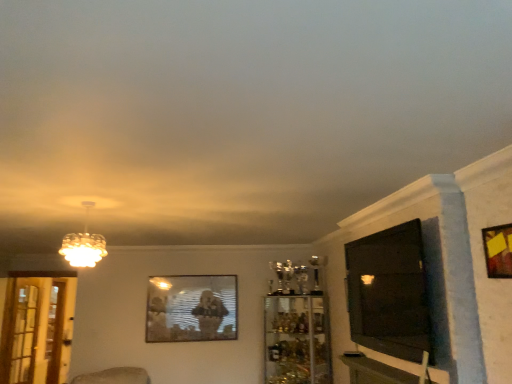
This screenshot has width=512, height=384. I want to click on wooden frame at upper right, the first picture frame from the top, so click(x=498, y=250).

This screenshot has height=384, width=512. What are the coordinates of `clear glass screen door at left, which appears as the second screen door when viewed from the left` in the screenshot? It's located at (37, 330).

The width and height of the screenshot is (512, 384). Describe the element at coordinates (84, 244) in the screenshot. I see `matte glass chandelier at upper left` at that location.

The image size is (512, 384). In order to click on wooden table at lower right in this screenshot , I will do `click(382, 371)`.

The image size is (512, 384). Identify the location of wooden screen door at left, which is the second screen door from front to back. (55, 331).

I want to click on open below the wooden frame at upper right, which is counted as the second picture frame, starting from the left (from the image's perspective), so click(389, 293).

Is black glossy tv at right oriented away from wooden frame at upper right, arranged as the second picture frame when viewed from the back?

black glossy tv at right does not have its back to wooden frame at upper right, arranged as the second picture frame when viewed from the back.

Is black glossy tv at right far away from wooden frame at upper right, the first picture frame from the top?

black glossy tv at right is actually quite close to wooden frame at upper right, the first picture frame from the top.

Considering their positions, is black glossy tv at right located in front of or behind wooden frame at upper right, which is counted as the second picture frame, starting from the left?

Clearly, black glossy tv at right is behind wooden frame at upper right, which is counted as the second picture frame, starting from the left.

You are a GUI agent. You are given a task and a screenshot of the screen. Output one action in this format:
    pyautogui.click(x=<x>, y=<y>)
    Task: Click on the furniture directly beneath the wooden frame at upper right, the first picture frame when ordered from front to back (from a real-world perspective)
    
    Given the screenshot: What is the action you would take?
    pyautogui.click(x=297, y=340)

Consider the image. From a real-world perspective, is wooden frame at upper right, arranged as the second picture frame when viewed from the back, physically located above or below clear glass cabinet at center?

In terms of real-world spatial position, wooden frame at upper right, arranged as the second picture frame when viewed from the back, is above clear glass cabinet at center.

Consider the image. Is wooden frame at upper right, the second picture frame in the bottom-to-top sequence, oriented away from clear glass cabinet at center?

No, wooden frame at upper right, the second picture frame in the bottom-to-top sequence, is not facing away from clear glass cabinet at center.

From the image's perspective, is wooden frame at upper right, the first picture frame when ordered from front to back, on clear glass cabinet at center?

Yes, from the image's perspective, wooden frame at upper right, the first picture frame when ordered from front to back, is over clear glass cabinet at center.

Does wooden table at lower right have a greater height compared to clear glass screen door at left, which is counted as the 1th screen door, starting from the front?

In fact, wooden table at lower right may be shorter than clear glass screen door at left, which is counted as the 1th screen door, starting from the front.

From a real-world perspective, relative to clear glass screen door at left, which appears as the second screen door when viewed from the left, is wooden table at lower right vertically above or below?

In terms of real-world spatial position, wooden table at lower right is above clear glass screen door at left, which appears as the second screen door when viewed from the left.

Is wooden table at lower right oriented away from clear glass screen door at left, which appears as the second screen door when viewed from the left?

No, wooden table at lower right's orientation is not away from clear glass screen door at left, which appears as the second screen door when viewed from the left.

I want to click on table in front of the clear glass screen door at left, positioned as the 1th screen door in right-to-left order, so click(x=382, y=371).

From the image's perspective, which is above, clear glass cabinet at center or wooden table at lower right?

wooden table at lower right, from the image's perspective.

From a real-world perspective, between clear glass cabinet at center and wooden table at lower right, who is vertically lower?

clear glass cabinet at center.

Which object is positioned more to the left, clear glass cabinet at center or wooden table at lower right?

Positioned to the left is clear glass cabinet at center.

Is clear glass cabinet at center completely or partially outside of wooden table at lower right?

Yes, clear glass cabinet at center is located beyond the bounds of wooden table at lower right.

Is clear glass screen door at left, which is counted as the 1th screen door, starting from the front, not near wooden screen door at left, which is the 2th screen door from right to left?

No, clear glass screen door at left, which is counted as the 1th screen door, starting from the front, is not far from wooden screen door at left, which is the 2th screen door from right to left.

Who is taller, clear glass screen door at left, which is counted as the 1th screen door, starting from the front, or wooden screen door at left, marked as the 1th screen door in a left-to-right arrangement?

wooden screen door at left, marked as the 1th screen door in a left-to-right arrangement, is taller.

Is the position of clear glass screen door at left, positioned as the 1th screen door in right-to-left order, more distant than that of wooden screen door at left, the first screen door viewed from the back?

No, the depth of clear glass screen door at left, positioned as the 1th screen door in right-to-left order, is less than that of wooden screen door at left, the first screen door viewed from the back.

Does point (10, 379) appear closer or farther from the camera than point (56, 371)?

Point (10, 379).

Between wooden table at lower right and clear glass cabinet at center, which one has larger size?

Bigger between the two is clear glass cabinet at center.

Which point is more forward, (x=352, y=383) or (x=278, y=364)?

Point (x=352, y=383)

Choose the correct answer: Is wooden table at lower right inside clear glass cabinet at center or outside it?

wooden table at lower right is located beyond the bounds of clear glass cabinet at center.

Could you tell me if wooden table at lower right is turned towards clear glass cabinet at center?

No, wooden table at lower right is not facing towards clear glass cabinet at center.

Find the location of a particular element. picture frame below the black glossy tv at right (from the image's perspective) is located at coordinates (192, 308).

Is black glossy tv at right oriented towards metallic reflective frame at center, placed as the 2th picture frame when sorted from front to back?

No, black glossy tv at right is not facing towards metallic reflective frame at center, placed as the 2th picture frame when sorted from front to back.

Would you say black glossy tv at right is to the left or to the right of metallic reflective frame at center, the 1th picture frame viewed from the back, in the picture?

black glossy tv at right is positioned on metallic reflective frame at center, the 1th picture frame viewed from the back,'s right side.

Which is in front, point (386, 269) or point (219, 308)?

Point (386, 269)

You are a GUI agent. You are given a task and a screenshot of the screen. Output one action in this format:
    pyautogui.click(x=<x>, y=<y>)
    Task: Click on the open behind the wooden frame at upper right, the first picture frame when ordered from front to back
    
    Given the screenshot: What is the action you would take?
    pyautogui.click(x=389, y=293)

Where is `furniture lying below the wooden frame at upper right, the second picture frame in the bottom-to-top sequence (from the image's perspective)`? This screenshot has width=512, height=384. furniture lying below the wooden frame at upper right, the second picture frame in the bottom-to-top sequence (from the image's perspective) is located at coordinates (297, 340).

Based on their spatial positions, is wooden table at lower right or matte glass chandelier at upper left closer to wooden frame at upper right, the first picture frame when ordered from front to back?

wooden table at lower right is positioned closer to the anchor wooden frame at upper right, the first picture frame when ordered from front to back.

Looking at the image, which one is located closer to wooden screen door at left, which is the second screen door from front to back, black glossy tv at right or clear glass screen door at left, which is counted as the 1th screen door, starting from the front?

clear glass screen door at left, which is counted as the 1th screen door, starting from the front.

Looking at the image, which one is located further to wooden frame at upper right, the second picture frame in the bottom-to-top sequence, clear glass screen door at left, which is counted as the 1th screen door, starting from the front, or black glossy tv at right?

clear glass screen door at left, which is counted as the 1th screen door, starting from the front, lies further to wooden frame at upper right, the second picture frame in the bottom-to-top sequence, than the other object.

Based on their spatial positions, is metallic reflective frame at center, placed as the 2th picture frame when sorted from front to back, or wooden frame at upper right, the second picture frame in the bottom-to-top sequence, further from wooden screen door at left, marked as the 1th screen door in a left-to-right arrangement?

wooden frame at upper right, the second picture frame in the bottom-to-top sequence, is further to wooden screen door at left, marked as the 1th screen door in a left-to-right arrangement.

Which object lies further to the anchor point wooden screen door at left, marked as the 1th screen door in a left-to-right arrangement, black glossy tv at right or matte glass chandelier at upper left?

The object further to wooden screen door at left, marked as the 1th screen door in a left-to-right arrangement, is black glossy tv at right.

Looking at the image, which one is located closer to clear glass screen door at left, which appears as the second screen door when viewed from the left, clear glass cabinet at center or wooden screen door at left, which is the 2th screen door from right to left?

wooden screen door at left, which is the 2th screen door from right to left, lies closer to clear glass screen door at left, which appears as the second screen door when viewed from the left, than the other object.

Estimate the real-world distances between objects in this image. Which object is further from clear glass screen door at left, which is counted as the 1th screen door, starting from the front, black glossy tv at right or wooden table at lower right?

black glossy tv at right lies further to clear glass screen door at left, which is counted as the 1th screen door, starting from the front, than the other object.

From the image, which object appears to be nearer to wooden table at lower right, wooden frame at upper right, the first picture frame when ordered from front to back, or metallic reflective frame at center, placed as the 2th picture frame when sorted from front to back?

Among the two, wooden frame at upper right, the first picture frame when ordered from front to back, is located nearer to wooden table at lower right.

This screenshot has height=384, width=512. In order to click on lamp between clear glass screen door at left, positioned as the 1th screen door in right-to-left order, and black glossy tv at right from left to right in this screenshot , I will do `click(84, 244)`.

This screenshot has height=384, width=512. Identify the location of lamp located between wooden frame at upper right, arranged as the first picture frame when viewed from the right, and metallic reflective frame at center, the 1th picture frame viewed from the back, in the depth direction. (84, 244).

At what (x,y) coordinates should I click in order to perform the action: click on lamp between wooden table at lower right and clear glass cabinet at center along the z-axis. Please return your answer as a coordinate pair (x, y). The height and width of the screenshot is (384, 512). Looking at the image, I should click on (84, 244).

Image resolution: width=512 pixels, height=384 pixels. I want to click on picture frame situated between clear glass screen door at left, which appears as the second screen door when viewed from the left, and black glossy tv at right from left to right, so click(192, 308).